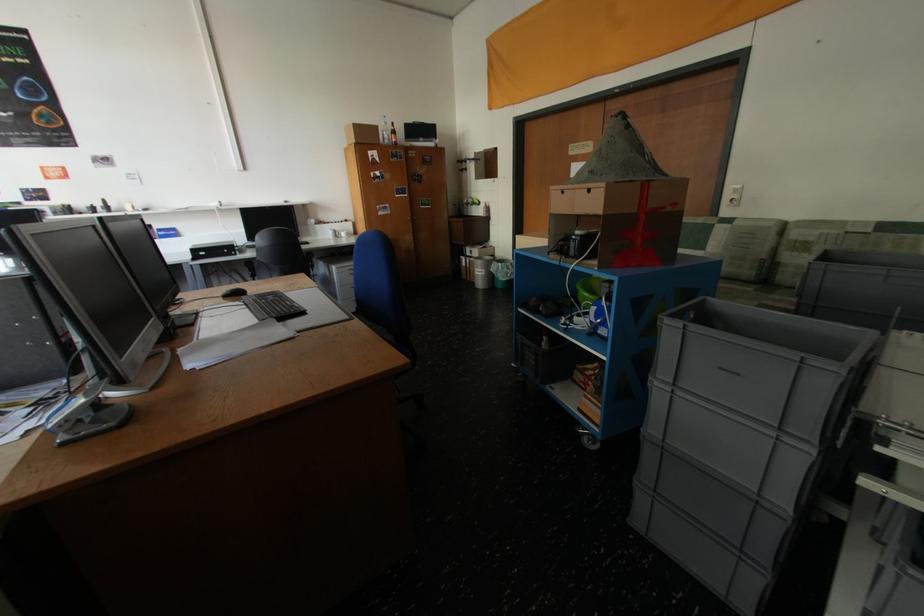
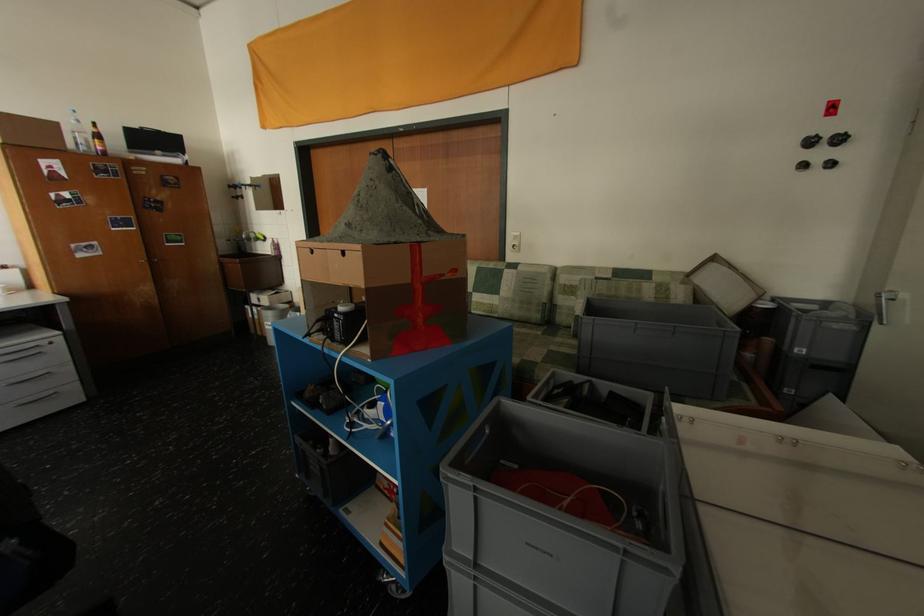
In a continuous first-person perspective shot, in which direction is the camera moving?

A: The cameraman walked toward right, forward.